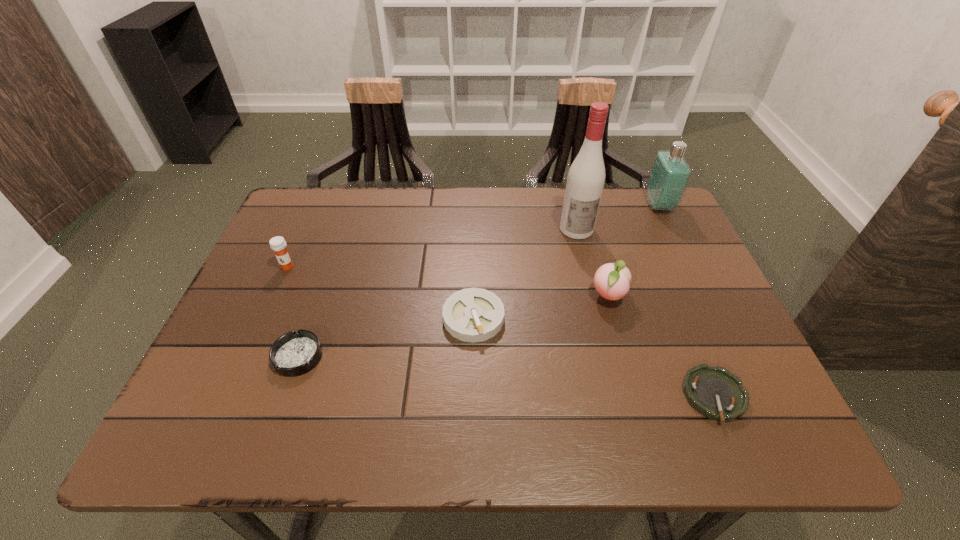
Identify the location of vacant space located on the back of the second tallest ashtray. (323, 288).

In order to click on free spot located on the left of the shortest object in this screenshot , I will do `click(583, 396)`.

This screenshot has width=960, height=540. I want to click on alcohol positioned at the far edge, so click(585, 181).

Image resolution: width=960 pixels, height=540 pixels. I want to click on perfume at the far edge, so click(x=670, y=174).

Image resolution: width=960 pixels, height=540 pixels. I want to click on object at the near edge, so click(x=716, y=393).

The image size is (960, 540). I want to click on medicine that is at the left edge, so click(x=278, y=244).

At what (x,y) coordinates should I click in order to perform the action: click on ashtray positioned at the left edge. Please return your answer as a coordinate pair (x, y). The image size is (960, 540). Looking at the image, I should click on (295, 353).

Where is `perfume situated at the right edge`? perfume situated at the right edge is located at coordinates click(x=670, y=174).

Find the location of a particular element. The image size is (960, 540). ashtray that is at the right edge is located at coordinates (716, 393).

This screenshot has width=960, height=540. What are the coordinates of `object positioned at the far right corner` in the screenshot? It's located at (670, 174).